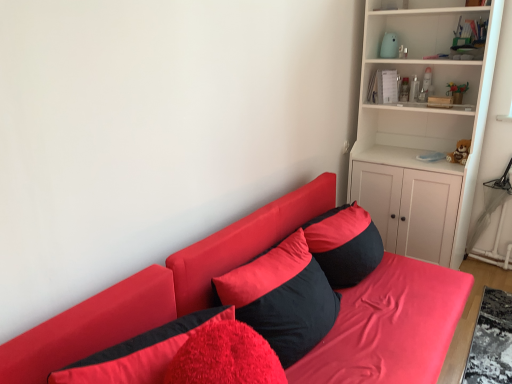
Question: Is velvet black pillow at center, which ranks as the 2th pillow in back-to-front order, taller or shorter than matte red couch at center?

Choices:
 (A) tall
 (B) short

Answer: (B)

Question: From a real-world perspective, is velvet black pillow at center, which is the 2th pillow from front to back, physically located above or below matte red couch at center?

Choices:
 (A) below
 (B) above

Answer: (B)

Question: Based on their relative distances, which object is nearer to the velvet black pillow at center, which ranks as the 2th pillow in back-to-front order?

Choices:
 (A) white matte cabinet at upper right
 (B) velvet red pillow at lower left, which is counted as the 1th pillow, starting from the front
 (C) matte red couch at center
 (D) black matte pillow at center, which is the 3th pillow from front to back
 (E) brown plush bear at upper right

Answer: (C)

Question: Estimate the real-world distances between objects in this image. Which object is closer to the matte red couch at center?

Choices:
 (A) white matte cabinet at upper right
 (B) velvet black pillow at center, which ranks as the 2th pillow in back-to-front order
 (C) black matte pillow at center, which is the 3th pillow from front to back
 (D) velvet red pillow at lower left, acting as the 3th pillow starting from the back
 (E) brown plush bear at upper right

Answer: (C)